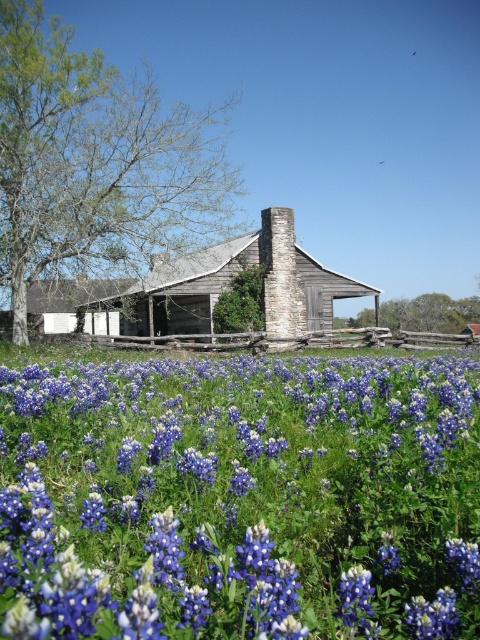
Question: Does blue matte flower at center appear on the right side of weathered wood barn at center?

Choices:
 (A) no
 (B) yes

Answer: (B)

Question: Is blue matte flower at center positioned at the back of weathered wood barn at center?

Choices:
 (A) no
 (B) yes

Answer: (A)

Question: Which object is closer to the camera taking this photo?

Choices:
 (A) weathered wood barn at center
 (B) blue matte flower at center

Answer: (B)

Question: Which point is closer to the camera?

Choices:
 (A) weathered wood barn at center
 (B) blue matte flower at center

Answer: (B)

Question: Which of the following is the closest to the observer?

Choices:
 (A) blue matte flower at center
 (B) weathered wood barn at center

Answer: (A)

Question: Is blue matte flower at center closer to camera compared to weathered wood barn at center?

Choices:
 (A) no
 (B) yes

Answer: (B)